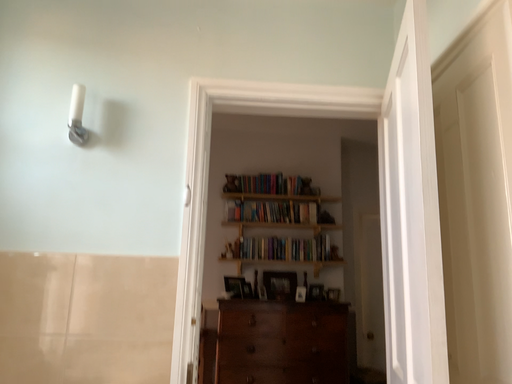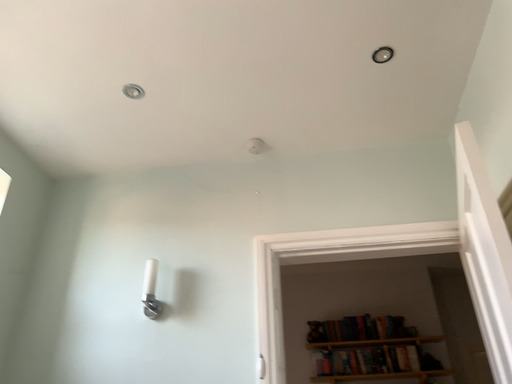
Question: Which way did the camera rotate in the video?

Choices:
 (A) rotated upward
 (B) rotated downward

Answer: (A)